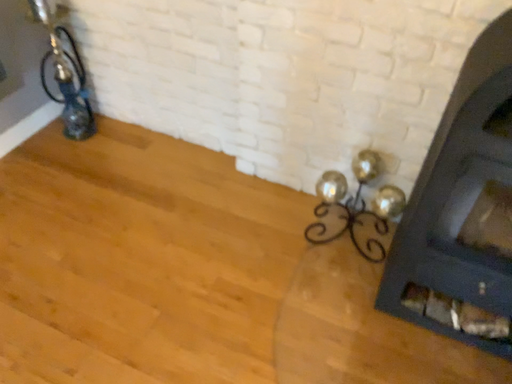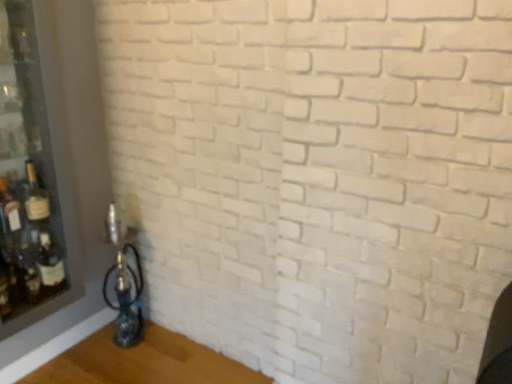
Question: How did the camera likely rotate when shooting the video?

Choices:
 (A) rotated upward
 (B) rotated downward

Answer: (A)